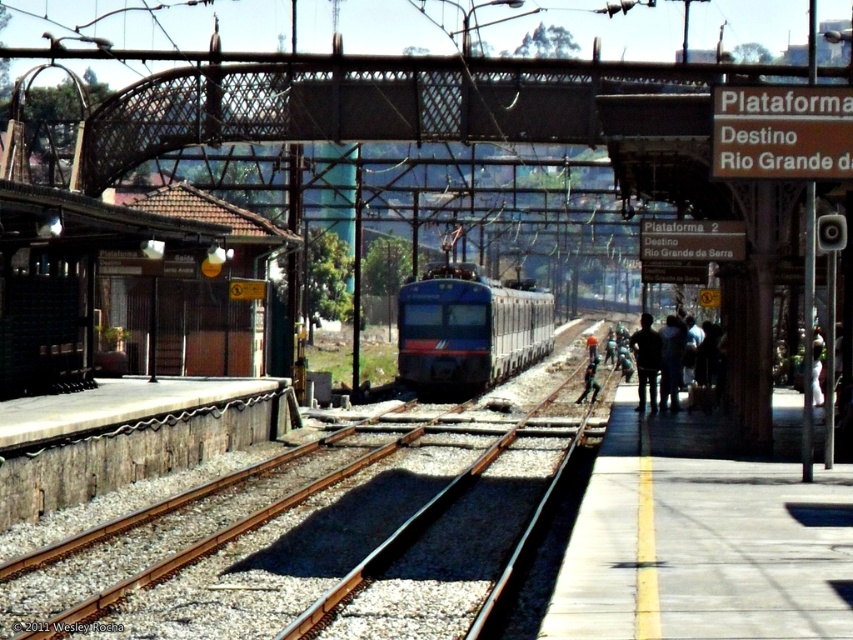
Question: Does concrete platform at right appear under dark blue fabric at right?

Choices:
 (A) no
 (B) yes

Answer: (B)

Question: Which of the following is the farthest from the observer?

Choices:
 (A) (548, 340)
 (B) (677, 532)
 (C) (642, 385)

Answer: (A)

Question: Can you confirm if smooth metal track at center is positioned to the right of dark blue uniform at center?

Choices:
 (A) yes
 (B) no

Answer: (B)

Question: Considering the real-world distances, which object is farthest from the concrete platform at right?

Choices:
 (A) smooth metal track at center
 (B) blue glossy train at center

Answer: (B)

Question: Among these points, which one is nearest to the camera?

Choices:
 (A) (38, 614)
 (B) (589, 611)
 (C) (637, 349)

Answer: (B)

Question: Is smooth metal track at center positioned at the back of dark blue fabric at right?

Choices:
 (A) yes
 (B) no

Answer: (B)